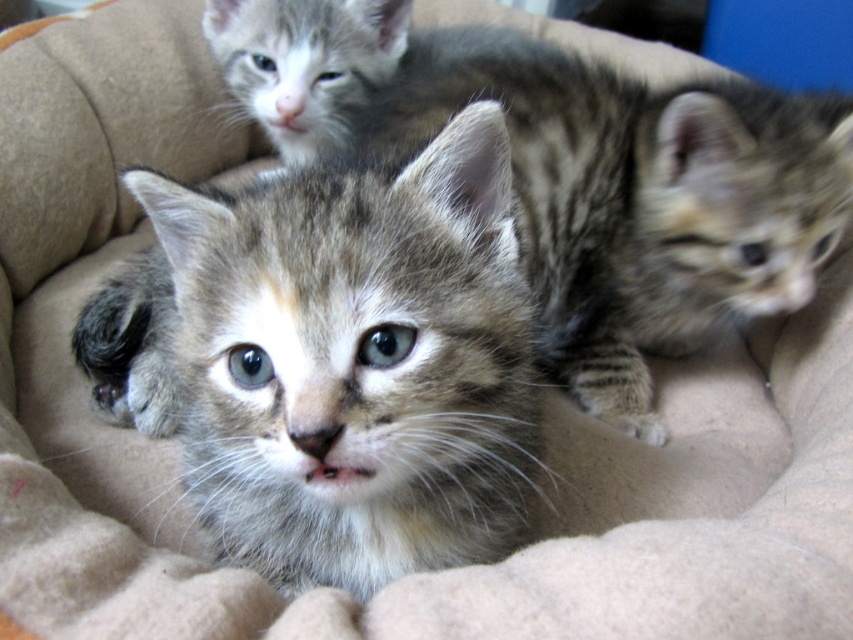
Question: Which object is farther from the camera taking this photo?

Choices:
 (A) tabby fur kitten at center
 (B) gray tabby kitten at center

Answer: (A)

Question: Which object is closer to the camera taking this photo?

Choices:
 (A) tabby fur kitten at center
 (B) gray tabby kitten at center

Answer: (B)

Question: Does gray tabby kitten at center appear on the left side of tabby fur kitten at center?

Choices:
 (A) no
 (B) yes

Answer: (B)

Question: Does gray tabby kitten at center have a larger size compared to tabby fur kitten at center?

Choices:
 (A) yes
 (B) no

Answer: (B)

Question: From the image, what is the correct spatial relationship of gray tabby kitten at center in relation to tabby fur kitten at center?

Choices:
 (A) below
 (B) above

Answer: (A)

Question: Which point is closer to the camera?

Choices:
 (A) tabby fur kitten at center
 (B) gray tabby kitten at center

Answer: (B)